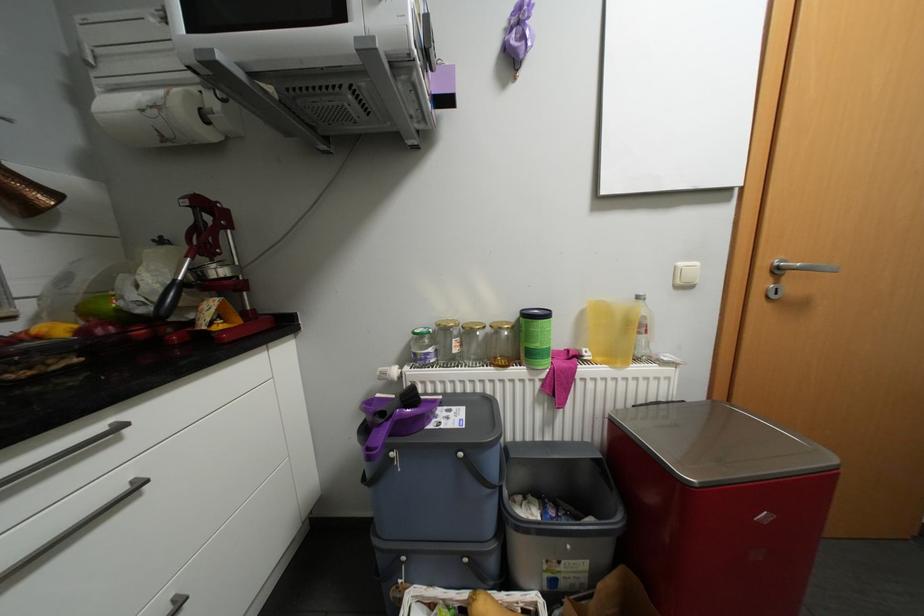
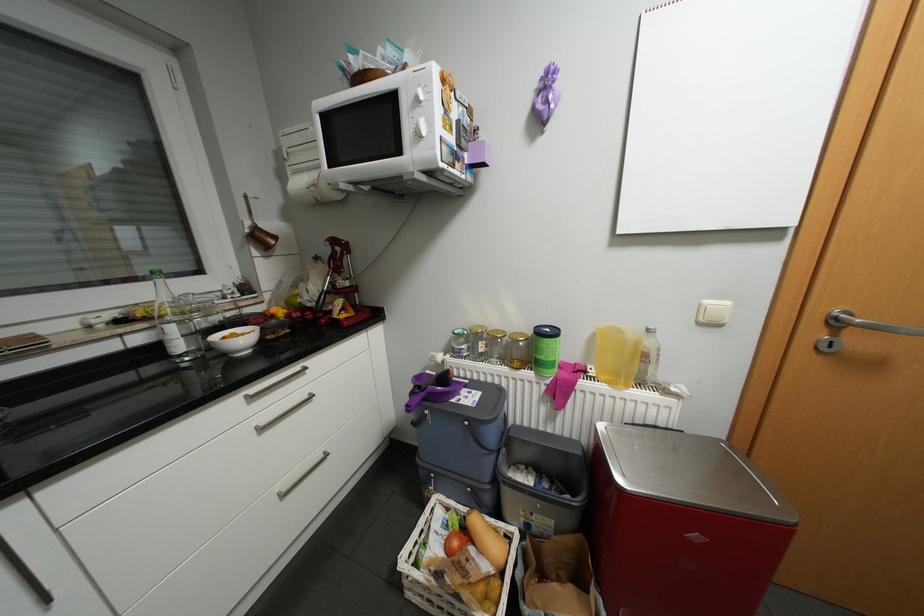
The point at (415, 368) is marked in the first image. Where is the corresponding point in the second image?

(456, 355)